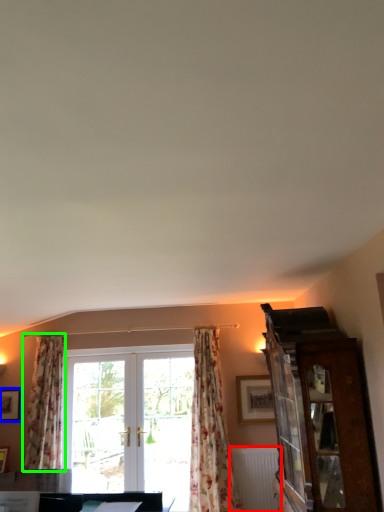
Question: Estimate the real-world distances between objects in this image. Which object is farther from radiator (highlighted by a red box), picture frame (highlighted by a blue box) or curtain (highlighted by a green box)?

Choices:
 (A) picture frame
 (B) curtain

Answer: (A)